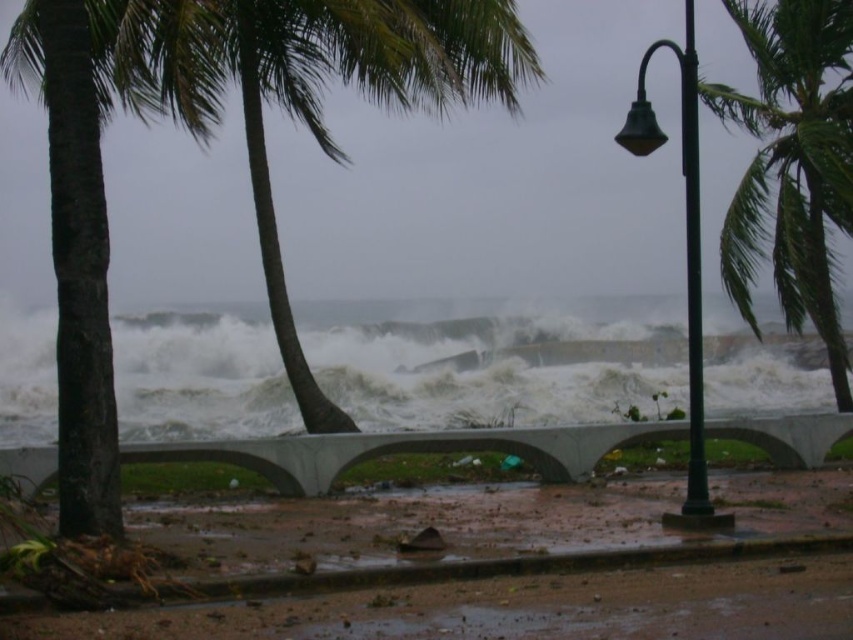
Question: Which object appears closest to the camera in this image?

Choices:
 (A) white frothy wave at center
 (B) green leafy palm tree at upper right
 (C) green matte lamp post at center right
 (D) green leafy palm tree at center

Answer: (C)

Question: Is brown dirt at lower center above green matte lamp post at center right?

Choices:
 (A) no
 (B) yes

Answer: (A)

Question: Estimate the real-world distances between objects in this image. Which object is farther from the green matte lamp post at center right?

Choices:
 (A) green leafy palm tree at upper right
 (B) white frothy wave at center

Answer: (B)

Question: Where is brown dirt at lower center located in relation to green leafy palm tree at center in the image?

Choices:
 (A) left
 (B) right

Answer: (B)

Question: Is brown dirt at lower center positioned in front of green leafy palm tree at upper right?

Choices:
 (A) yes
 (B) no

Answer: (A)

Question: Which point is closer to the camera?

Choices:
 (A) green leafy palm tree at upper right
 (B) green matte lamp post at center right

Answer: (B)